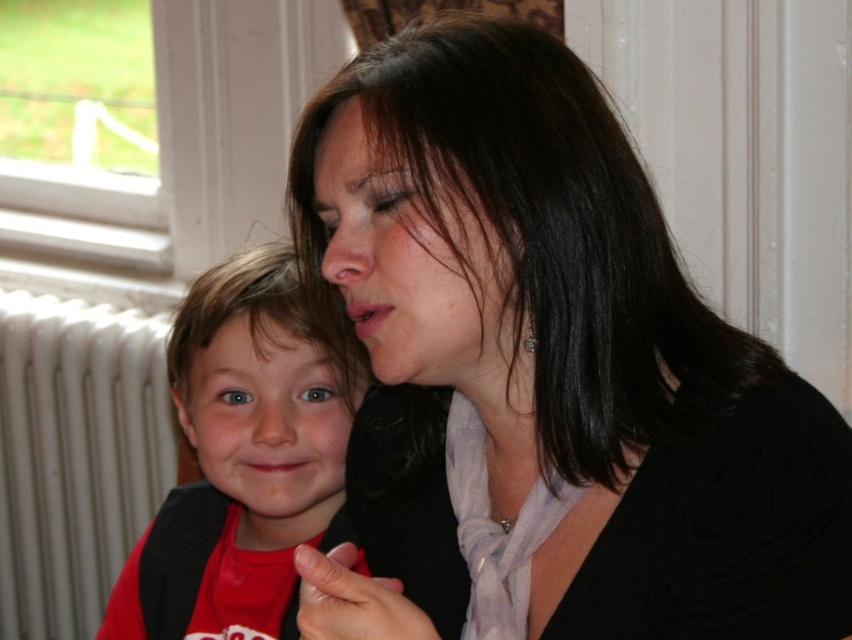
Question: Which object appears farthest from the camera in this image?

Choices:
 (A) black matte scarf at center
 (B) red shirt at center
 (C) white metallic radiator at left

Answer: (C)

Question: Is red shirt at center positioned behind white metallic radiator at left?

Choices:
 (A) yes
 (B) no

Answer: (B)

Question: Which object is the farthest from the black matte scarf at center?

Choices:
 (A) red shirt at center
 (B) white metallic radiator at left

Answer: (B)

Question: Is black matte scarf at center bigger than red shirt at center?

Choices:
 (A) no
 (B) yes

Answer: (B)

Question: Estimate the real-world distances between objects in this image. Which object is farther from the white metallic radiator at left?

Choices:
 (A) black matte scarf at center
 (B) red shirt at center

Answer: (A)

Question: In this image, where is black matte scarf at center located relative to white metallic radiator at left?

Choices:
 (A) below
 (B) above

Answer: (B)